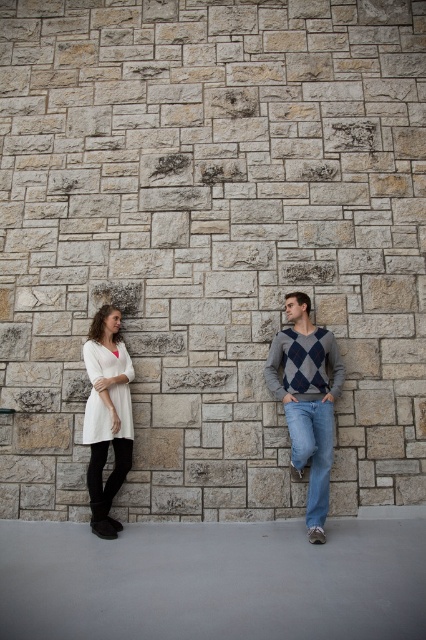
Can you confirm if argyle sweater at center is positioned below white matte tunic at left?

Incorrect, argyle sweater at center is not positioned below white matte tunic at left.

Can you confirm if argyle sweater at center is wider than white matte tunic at left?

Yes.

Based on the photo, measure the distance between argyle sweater at center and camera.

The distance of argyle sweater at center from camera is 4.09 meters.

Find the location of `argyle sweater at center`. argyle sweater at center is located at coordinates (307, 401).

Who is higher up, white matte tunic at left or denim jeans at lower right?

white matte tunic at left is higher up.

Which of these two, white matte tunic at left or denim jeans at lower right, stands shorter?

denim jeans at lower right is shorter.

Measure the distance between white matte tunic at left and camera.

white matte tunic at left and camera are 4.31 meters apart.

This screenshot has width=426, height=640. Identify the location of white matte tunic at left. (106, 416).

Does white cotton dress at left appear on the right side of white matte tunic at left?

Indeed, white cotton dress at left is positioned on the right side of white matte tunic at left.

Is white cotton dress at left smaller than white matte tunic at left?

Incorrect, white cotton dress at left is not smaller in size than white matte tunic at left.

What do you see at coordinates (307, 401) in the screenshot? The width and height of the screenshot is (426, 640). I see `white cotton dress at left` at bounding box center [307, 401].

Locate an element on the screen. This screenshot has height=640, width=426. white cotton dress at left is located at coordinates point(307,401).